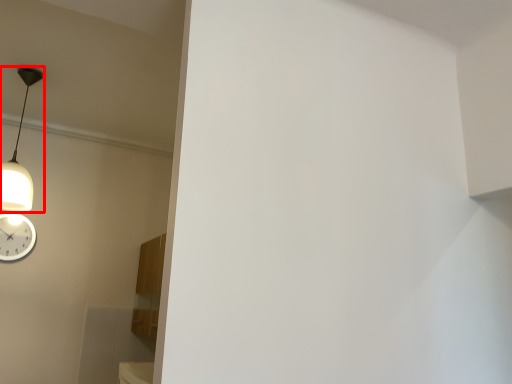
Question: From the image's perspective, where is lamp (annotated by the red box) located relative to wall clock?

Choices:
 (A) below
 (B) above

Answer: (B)